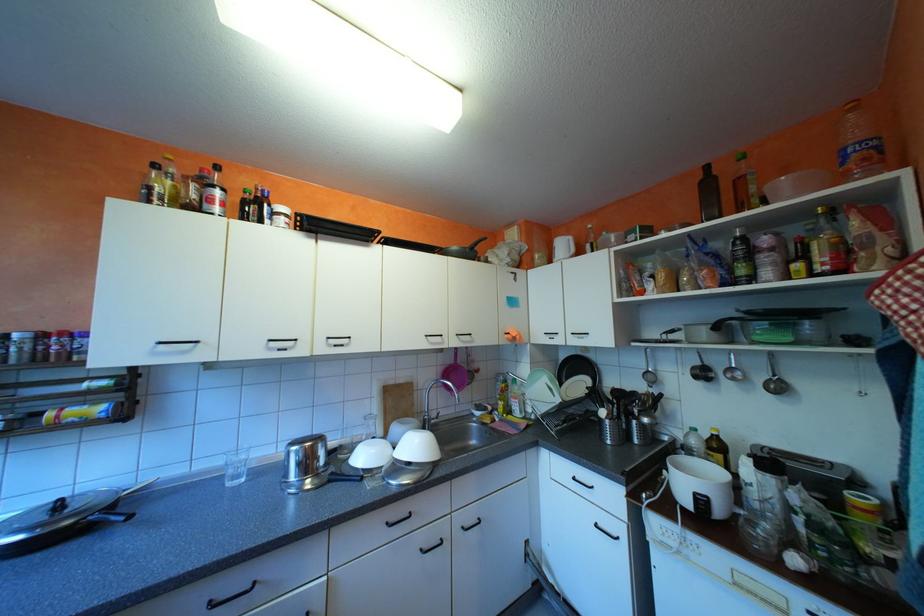
Describe the element at coordinates (108, 516) in the screenshot. The height and width of the screenshot is (616, 924). I see `the pot handle` at that location.